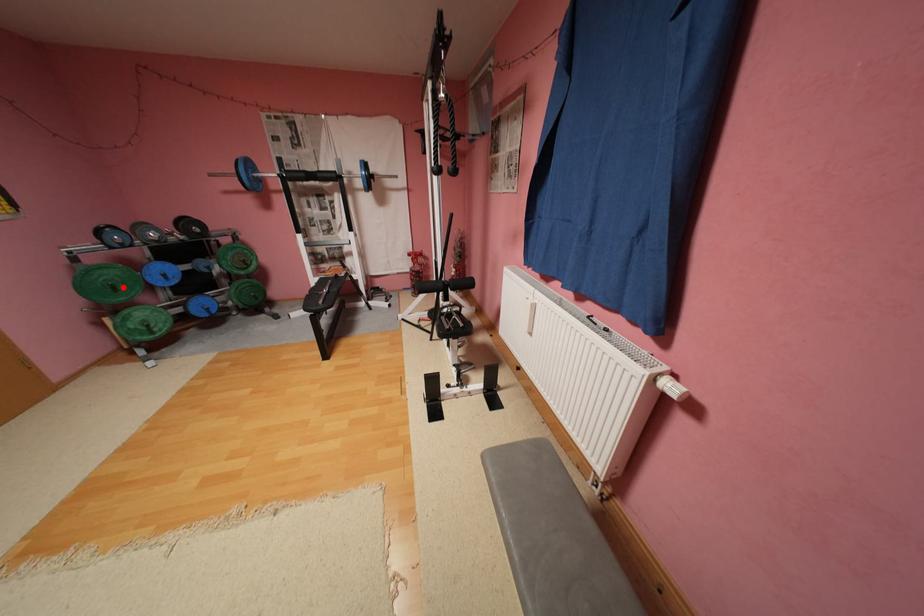
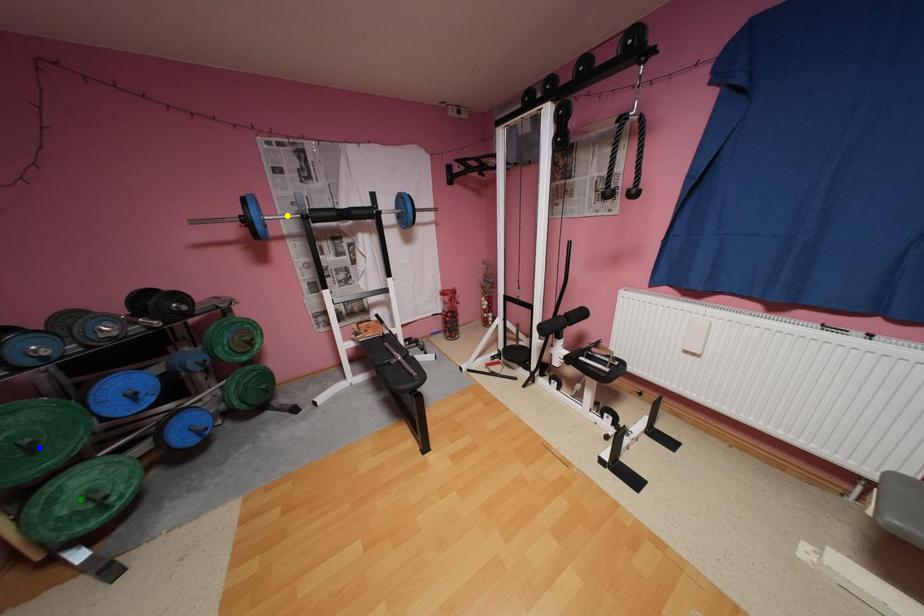
Question: I am providing you with two images of the same scene from different viewpoints. A red point is marked on the first image. You are given multiple points on the second image. Which spot in image 2 lines up with the point in image 1?

Choices:
 (A) blue point
 (B) green point
 (C) yellow point

Answer: (A)